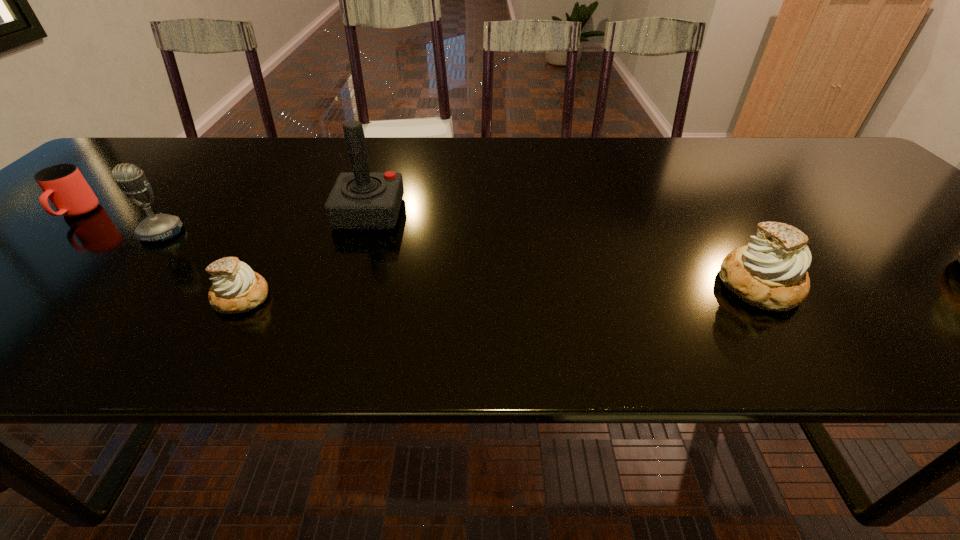
Find the location of a particular element. This screenshot has height=540, width=960. the shorter pastry is located at coordinates (236, 288).

At what (x,y) coordinates should I click in order to perform the action: click on the third object from left to right. Please return your answer as a coordinate pair (x, y). Looking at the image, I should click on (236, 288).

Where is `the taller pastry`? This screenshot has width=960, height=540. the taller pastry is located at coordinates (770, 273).

Locate an element on the screen. the rightmost object is located at coordinates (770, 273).

Identify the location of the leftmost object. (63, 184).

Where is `the second tallest object`? The image size is (960, 540). the second tallest object is located at coordinates (130, 179).

Find the location of a particular element. Image resolution: width=960 pixels, height=540 pixels. microphone is located at coordinates coord(130,179).

Find the location of a particular element. The image size is (960, 540). joystick is located at coordinates (360, 200).

The image size is (960, 540). Find the location of `the fourth object from left to right`. the fourth object from left to right is located at coordinates (360, 200).

The height and width of the screenshot is (540, 960). In order to click on vacant position located 0.080m on the right of the shorter pastry in this screenshot , I will do `click(312, 297)`.